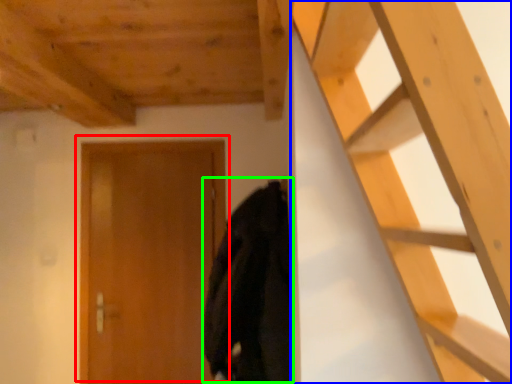
Question: Which object is positioned closest to door (highlighted by a red box)? Select from ladder (highlighted by a blue box) and cloak (highlighted by a green box).

Choices:
 (A) ladder
 (B) cloak

Answer: (B)